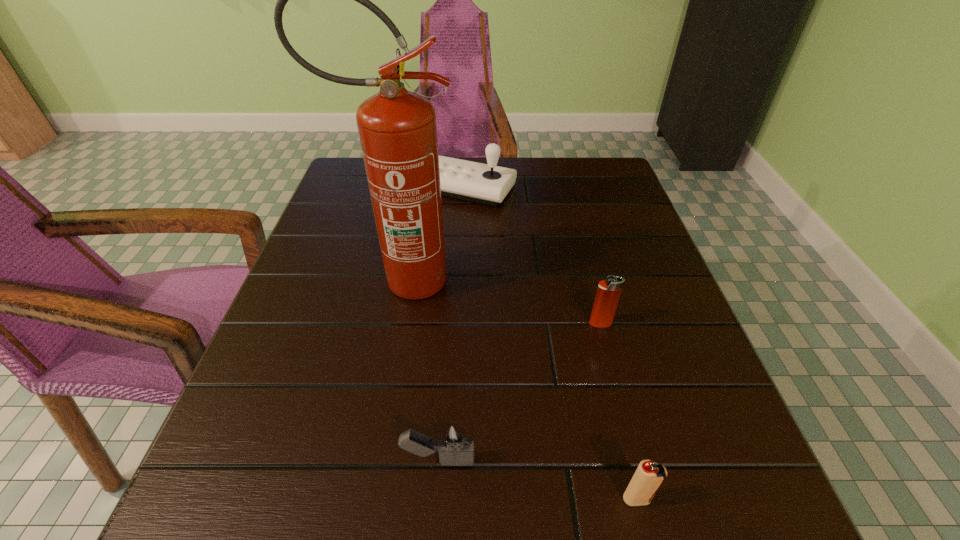
Identify the location of vacant space located 0.380m on the back of the second nearest igniter. (452, 271).

I want to click on free space located on the left of the nearest igniter, so click(504, 499).

Locate an element on the screen. This screenshot has height=540, width=960. object located at the far edge is located at coordinates (488, 184).

Identify the location of object that is at the left edge. This screenshot has width=960, height=540. (397, 128).

The width and height of the screenshot is (960, 540). I want to click on object that is at the near right corner, so click(649, 476).

Find the location of a particular element. The height and width of the screenshot is (540, 960). vacant space at the near edge is located at coordinates (582, 493).

I want to click on vacant space at the left edge, so click(348, 283).

Find the location of a particular element. The width and height of the screenshot is (960, 540). free region at the right edge of the desktop is located at coordinates (628, 388).

Where is `vacant space at the far left corner`? This screenshot has width=960, height=540. vacant space at the far left corner is located at coordinates point(347,197).

This screenshot has width=960, height=540. What are the coordinates of `vacant region at the near left corner` in the screenshot? It's located at (300, 485).